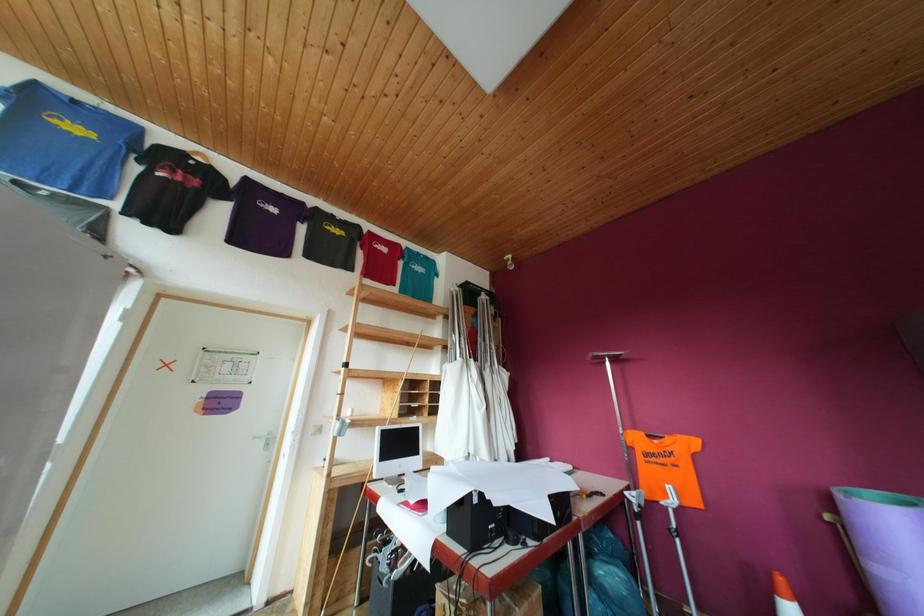
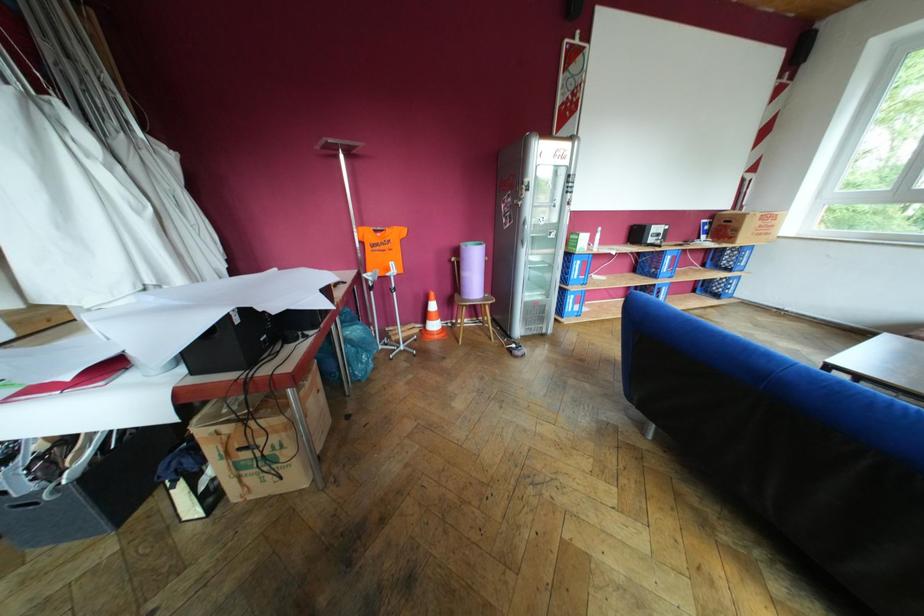
First-person continuous shooting, in which direction is the camera rotating?

The camera's rotation is toward right-down.